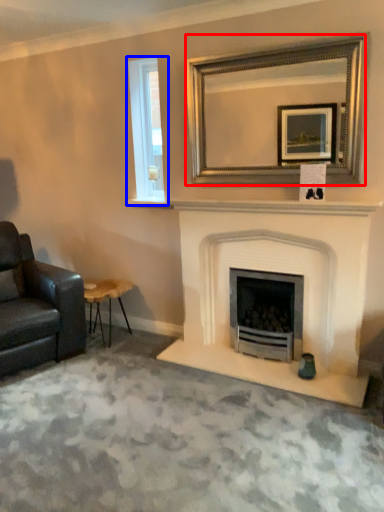
Question: Among these objects, which one is farthest to the camera, mirror (highlighted by a red box) or window (highlighted by a blue box)?

Choices:
 (A) mirror
 (B) window

Answer: (B)